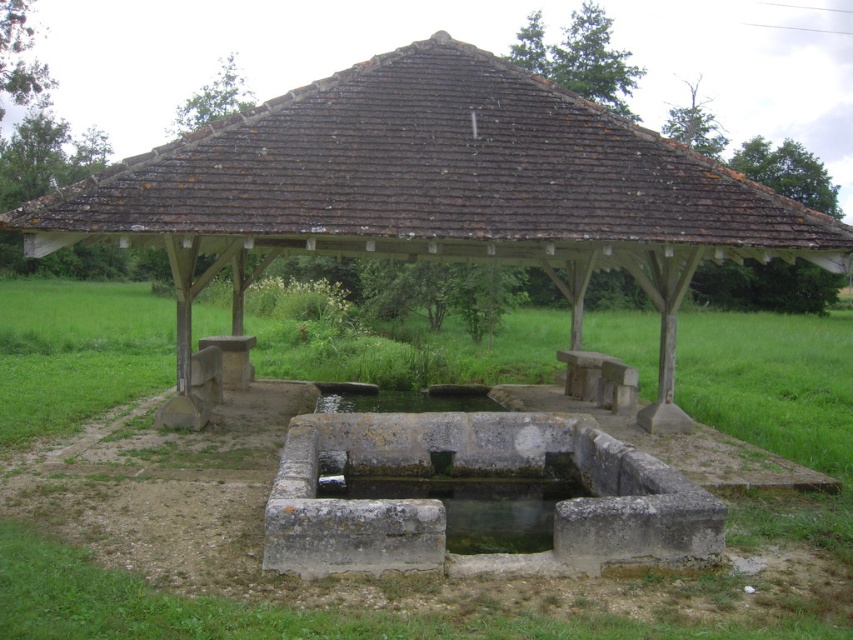
Question: Can you confirm if stone roofed hut at center is bigger than green grass at center?

Choices:
 (A) yes
 (B) no

Answer: (B)

Question: Which of the following is the closest to the observer?

Choices:
 (A) (701, 317)
 (B) (335, 161)

Answer: (B)

Question: Is stone roofed hut at center below green grass at center?

Choices:
 (A) yes
 (B) no

Answer: (B)

Question: Does stone roofed hut at center have a larger size compared to green grass at center?

Choices:
 (A) yes
 (B) no

Answer: (B)

Question: Which point is closer to the camera?

Choices:
 (A) (763, 424)
 (B) (471, 45)

Answer: (B)